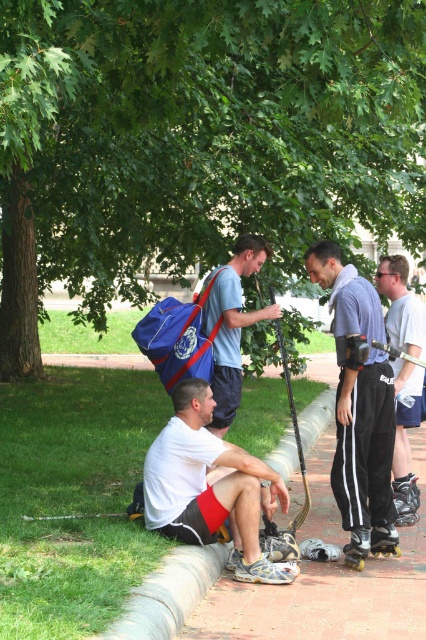
You are a photographer setting up a tripod to capture the scene. The tripod requires a minimum height difference of 10 cm between the two objects to ensure proper framing. Given the white matte shorts at lower left and the matte blue backpack at center, can you confirm if their height difference meets this requirement?

The white matte shorts at lower left is shorter than the matte blue backpack at center, but the exact height difference is not provided. Therefore, it is uncertain if it meets the 10 cm requirement.

You are a photographer trying to capture a photo of both the black rubber roller skate at lower right and the yellow plastic roller skate at lower right. Since both are at the lower right, which one should you adjust your camera angle to focus on first to ensure both are in frame?

The black rubber roller skate at lower right is to the right of the yellow plastic roller skate at lower right, so you should focus on the yellow plastic roller skate at lower right first to ensure both are in frame.

You are a photographer trying to capture a group photo of the people in the park. You need to ensure that both the white matte shorts at lower left and the matte blue backpack at center are visible in the frame. Based on their positions, which object should be placed closer to the left edge of the photo to include both?

The white matte shorts at lower left should be placed closer to the left edge of the photo since it is positioned on the left side of the matte blue backpack at center, ensuring both objects are visible.